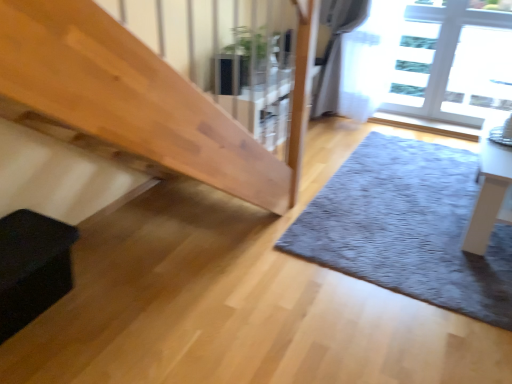
Question: Is green glossy plant at upper center completely or partially inside transparent glass window at upper right?

Choices:
 (A) yes
 (B) no

Answer: (B)

Question: Considering the relative sizes of transparent glass window at upper right and green glossy plant at upper center in the image provided, is transparent glass window at upper right wider than green glossy plant at upper center?

Choices:
 (A) no
 (B) yes

Answer: (A)

Question: Is transparent glass window at upper right with green glossy plant at upper center?

Choices:
 (A) no
 (B) yes

Answer: (A)

Question: Considering the relative sizes of transparent glass window at upper right and green glossy plant at upper center in the image provided, is transparent glass window at upper right smaller than green glossy plant at upper center?

Choices:
 (A) yes
 (B) no

Answer: (A)

Question: Can you confirm if transparent glass window at upper right is thinner than green glossy plant at upper center?

Choices:
 (A) yes
 (B) no

Answer: (A)

Question: Choose the correct answer: Is transparent glass window at upper right inside black matte box at lower left or outside it?

Choices:
 (A) inside
 (B) outside

Answer: (B)

Question: In terms of width, does transparent glass window at upper right look wider or thinner when compared to black matte box at lower left?

Choices:
 (A) thin
 (B) wide

Answer: (A)

Question: From a real-world perspective, is transparent glass window at upper right physically located above or below black matte box at lower left?

Choices:
 (A) above
 (B) below

Answer: (A)

Question: Is point (462, 57) closer or farther from the camera than point (22, 286)?

Choices:
 (A) closer
 (B) farther

Answer: (B)

Question: In terms of width, does white glossy table at right look wider or thinner when compared to transparent glass window at upper right?

Choices:
 (A) wide
 (B) thin

Answer: (A)

Question: Is white glossy table at right inside the boundaries of transparent glass window at upper right, or outside?

Choices:
 (A) inside
 (B) outside

Answer: (B)

Question: Considering the positions of white glossy table at right and transparent glass window at upper right in the image, is white glossy table at right taller or shorter than transparent glass window at upper right?

Choices:
 (A) short
 (B) tall

Answer: (A)

Question: In the image, is white glossy table at right positioned in front of or behind transparent glass window at upper right?

Choices:
 (A) front
 (B) behind

Answer: (A)

Question: From a real-world perspective, is black matte box at lower left physically located above or below white glossy table at right?

Choices:
 (A) below
 (B) above

Answer: (A)

Question: Is black matte box at lower left taller or shorter than white glossy table at right?

Choices:
 (A) tall
 (B) short

Answer: (B)